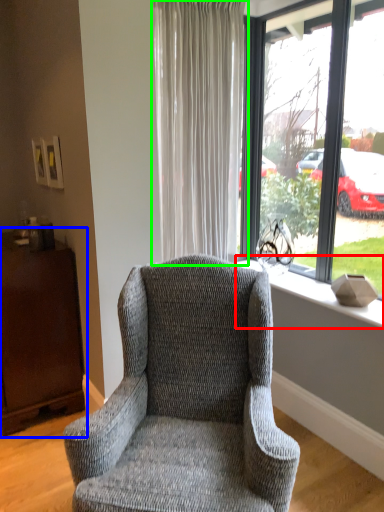
Question: Which object is positioned closest to window sill (highlighted by a red box)? Select from dresser (highlighted by a blue box) and curtain (highlighted by a green box).

Choices:
 (A) dresser
 (B) curtain

Answer: (B)